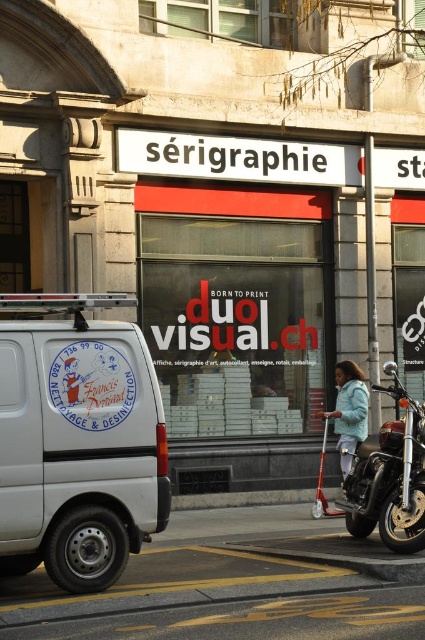
Question: Can you confirm if white matte van at left is bigger than light blue fabric jacket at center?

Choices:
 (A) yes
 (B) no

Answer: (A)

Question: Among these points, which one is nearest to the camera?

Choices:
 (A) (2, 364)
 (B) (414, 401)
 (C) (339, 397)

Answer: (A)

Question: Among these points, which one is farthest from the camera?

Choices:
 (A) (351, 365)
 (B) (85, 472)

Answer: (A)

Question: Considering the real-world distances, which object is farthest from the shiny chrome motorcycle at right?

Choices:
 (A) white matte van at left
 (B) light blue fabric jacket at center

Answer: (A)

Question: Does white matte van at left have a smaller size compared to light blue fabric jacket at center?

Choices:
 (A) no
 (B) yes

Answer: (A)

Question: Does white matte van at left have a greater width compared to shiny chrome motorcycle at right?

Choices:
 (A) no
 (B) yes

Answer: (B)